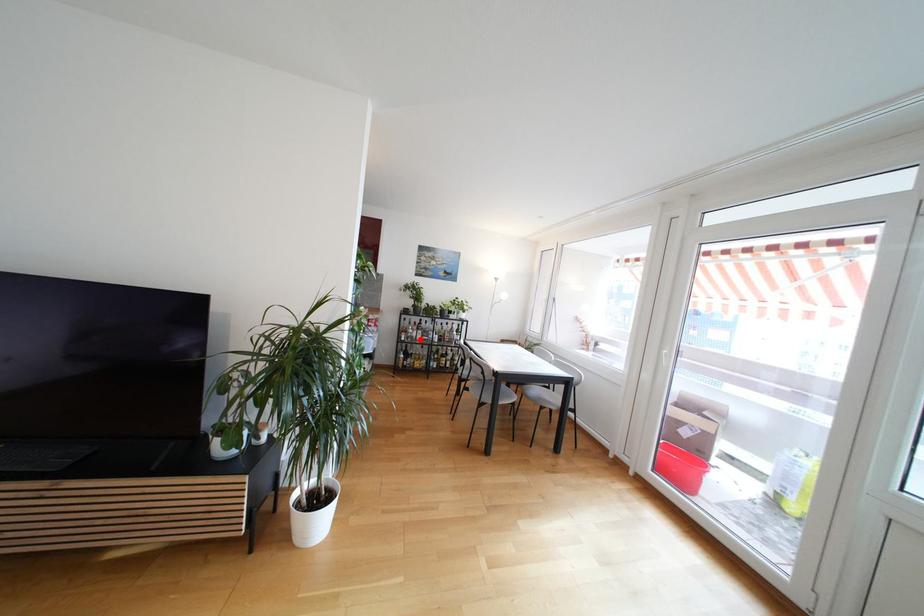
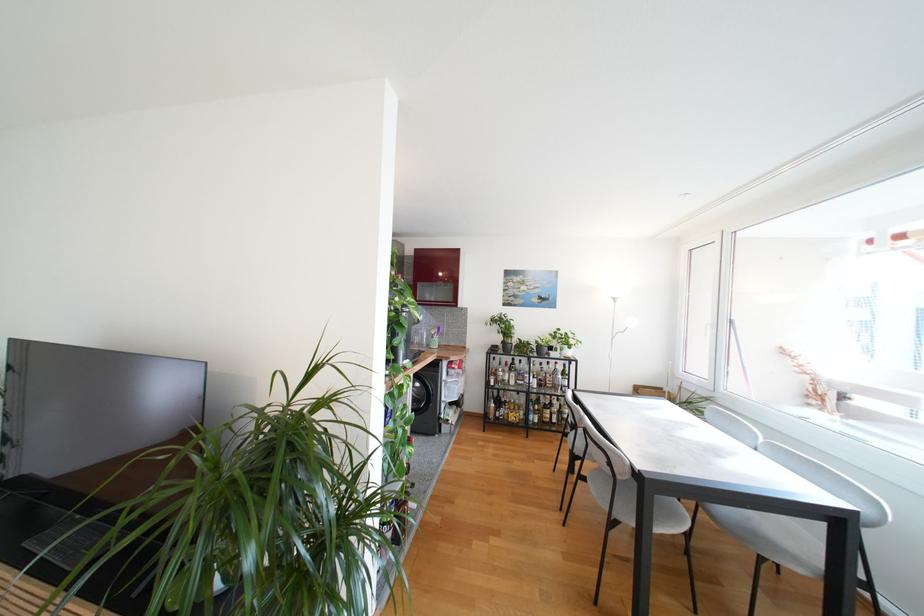
Locate, in the second image, the point that corresponds to the highlighted location in the first image.

(513, 383)